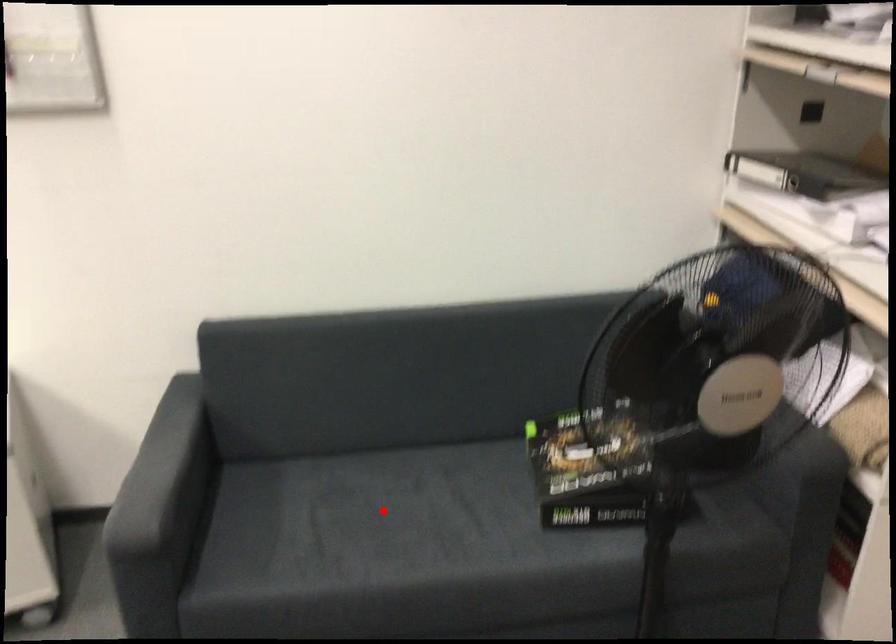
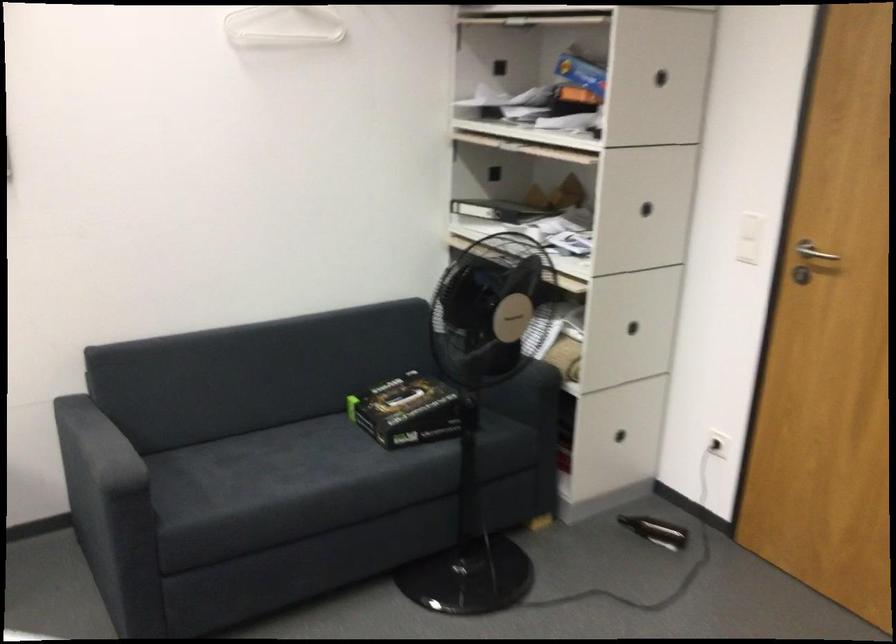
Find the pixel in the second image that matches the highlighted location in the first image.

(268, 462)